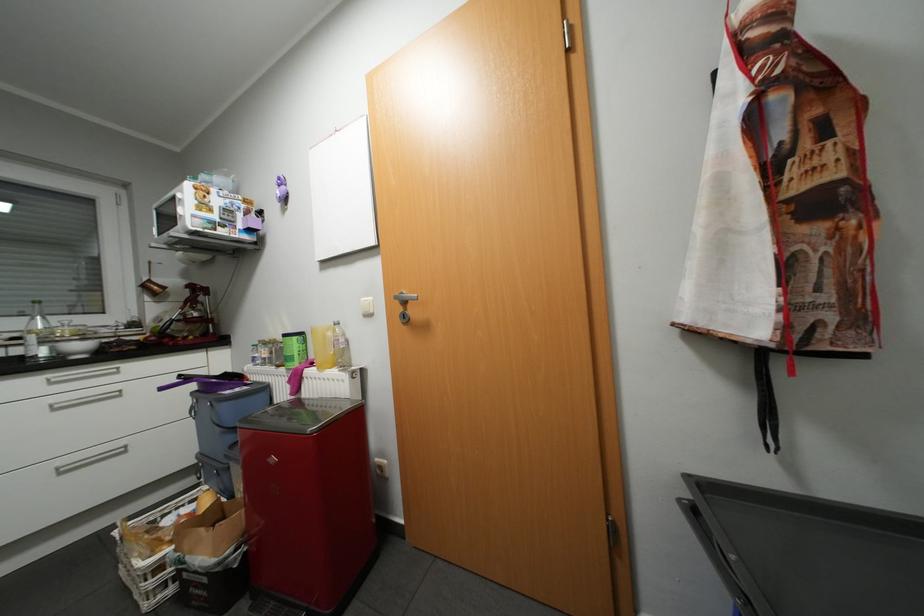
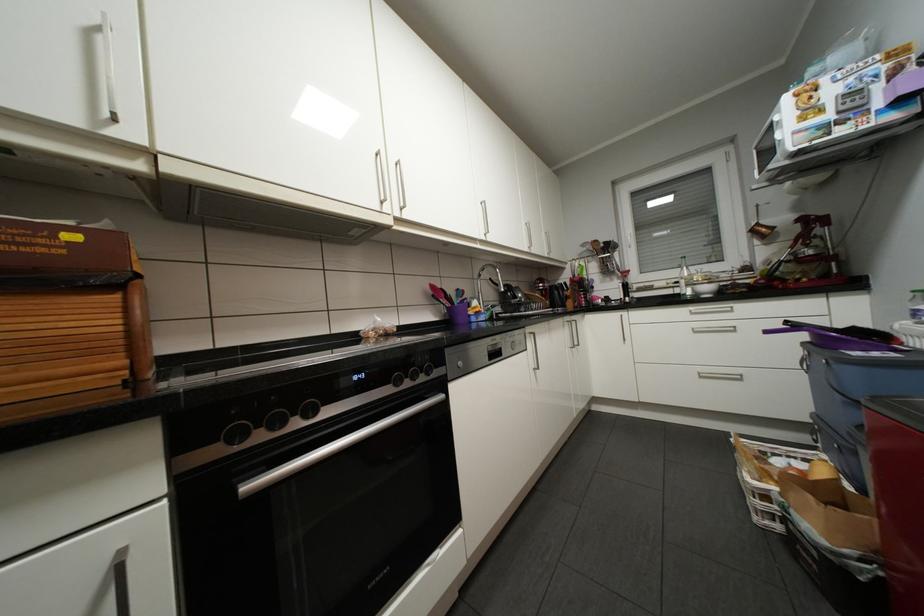
Question: The camera is either moving clockwise (left) or counter-clockwise (right) around the object. The first image is from the beginning of the video and the second image is from the end. Is the camera moving left or right when shooting the video?

Choices:
 (A) Left
 (B) Right

Answer: (B)